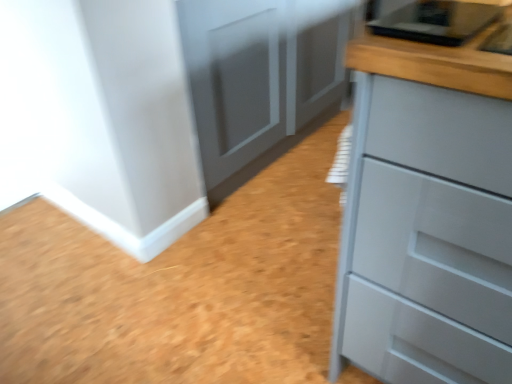
Where is `matte gray chest of drawers at right`? matte gray chest of drawers at right is located at coordinates (426, 215).

Image resolution: width=512 pixels, height=384 pixels. What do you see at coordinates (426, 215) in the screenshot?
I see `matte gray chest of drawers at right` at bounding box center [426, 215].

What do you see at coordinates (261, 78) in the screenshot? I see `matte gray cupboard at center` at bounding box center [261, 78].

Locate an element on the screen. This screenshot has height=384, width=512. matte gray cupboard at center is located at coordinates (261, 78).

Where is `matte gray chest of drawers at right`? Image resolution: width=512 pixels, height=384 pixels. matte gray chest of drawers at right is located at coordinates (426, 215).

Can you confirm if matte gray chest of drawers at right is positioned to the right of matte gray cupboard at center?

Yes, matte gray chest of drawers at right is to the right of matte gray cupboard at center.

Which object is further away from the camera, matte gray chest of drawers at right or matte gray cupboard at center?

matte gray cupboard at center is behind.

Considering the positions of points (460, 345) and (242, 119), is point (460, 345) farther from camera compared to point (242, 119)?

No, (460, 345) is in front of (242, 119).

From the image's perspective, which one is positioned lower, matte gray chest of drawers at right or matte gray cupboard at center?

matte gray chest of drawers at right.

From a real-world perspective, is matte gray chest of drawers at right physically above matte gray cupboard at center?

Yes, from a real-world perspective, matte gray chest of drawers at right is above matte gray cupboard at center.

Considering the sizes of objects matte gray chest of drawers at right and matte gray cupboard at center in the image provided, who is thinner, matte gray chest of drawers at right or matte gray cupboard at center?

With smaller width is matte gray cupboard at center.

In terms of height, does matte gray chest of drawers at right look taller or shorter compared to matte gray cupboard at center?

Considering their sizes, matte gray chest of drawers at right has more height than matte gray cupboard at center.

Considering the sizes of objects matte gray chest of drawers at right and matte gray cupboard at center in the image provided, who is bigger, matte gray chest of drawers at right or matte gray cupboard at center?

matte gray cupboard at center is bigger.

Would you say matte gray chest of drawers at right is inside or outside matte gray cupboard at center?

matte gray chest of drawers at right is not enclosed by matte gray cupboard at center.

Is matte gray chest of drawers at right touching matte gray cupboard at center?

No.

Consider the image. Does matte gray chest of drawers at right turn towards matte gray cupboard at center?

No, matte gray chest of drawers at right does not turn towards matte gray cupboard at center.

How different are the orientations of matte gray chest of drawers at right and matte gray cupboard at center in degrees?

The facing directions of matte gray chest of drawers at right and matte gray cupboard at center are 89.7 degrees apart.

Where is `cupboard lying on the left of matte gray chest of drawers at right`? The image size is (512, 384). cupboard lying on the left of matte gray chest of drawers at right is located at coordinates (261, 78).

Based on the photo, does matte gray cupboard at center appear on the right side of matte gray chest of drawers at right?

No.

Between matte gray cupboard at center and matte gray chest of drawers at right, which one is positioned behind?

matte gray cupboard at center is further from the camera.

Which is behind, point (327, 40) or point (481, 314)?

The point (327, 40) is farther from the camera.

From the image's perspective, is matte gray cupboard at center located above or below matte gray chest of drawers at right?

matte gray cupboard at center is situated higher than matte gray chest of drawers at right in the image.

From a real-world perspective, is matte gray cupboard at center on matte gray chest of drawers at right?

No, from a real-world perspective, matte gray cupboard at center is not on top of matte gray chest of drawers at right.

Is matte gray cupboard at center thinner than matte gray chest of drawers at right?

Correct, the width of matte gray cupboard at center is less than that of matte gray chest of drawers at right.

Considering the sizes of objects matte gray cupboard at center and matte gray chest of drawers at right in the image provided, who is shorter, matte gray cupboard at center or matte gray chest of drawers at right?

Standing shorter between the two is matte gray cupboard at center.

Considering the sizes of matte gray cupboard at center and matte gray chest of drawers at right in the image, is matte gray cupboard at center bigger or smaller than matte gray chest of drawers at right?

matte gray cupboard at center is bigger than matte gray chest of drawers at right.

Would you say matte gray chest of drawers at right is part of matte gray cupboard at center's contents?

No, matte gray chest of drawers at right is not surrounded by matte gray cupboard at center.

Is matte gray cupboard at center next to matte gray chest of drawers at right?

matte gray cupboard at center is not next to matte gray chest of drawers at right, and they're not touching.

Could you tell me if matte gray cupboard at center is facing matte gray chest of drawers at right?

Yes, matte gray cupboard at center is aimed at matte gray chest of drawers at right.

What's the angular difference between matte gray cupboard at center and matte gray chest of drawers at right's facing directions?

They differ by 89.7 degrees in their facing directions.

The image size is (512, 384). Find the location of `cupboard that is under the matte gray chest of drawers at right (from a real-world perspective)`. cupboard that is under the matte gray chest of drawers at right (from a real-world perspective) is located at coordinates (261, 78).

Where is `the chest of drawers that appears below the matte gray cupboard at center (from the image's perspective)`? The image size is (512, 384). the chest of drawers that appears below the matte gray cupboard at center (from the image's perspective) is located at coordinates tap(426, 215).

At what (x,y) coordinates should I click in order to perform the action: click on cupboard to the left of matte gray chest of drawers at right. Please return your answer as a coordinate pair (x, y). Looking at the image, I should click on (261, 78).